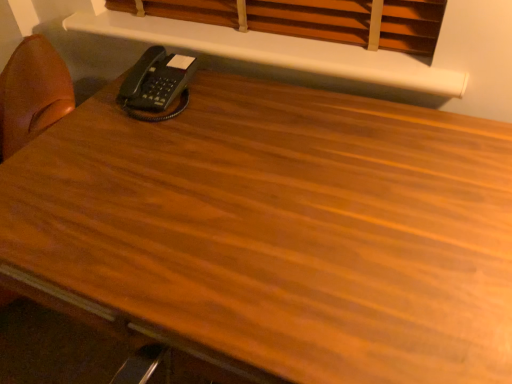
Question: Does wooden blinds at upper center have a greater height compared to black plastic phone at upper left?

Choices:
 (A) yes
 (B) no

Answer: (A)

Question: Is wooden blinds at upper center to the left of black plastic phone at upper left from the viewer's perspective?

Choices:
 (A) no
 (B) yes

Answer: (A)

Question: Are wooden blinds at upper center and black plastic phone at upper left far apart?

Choices:
 (A) no
 (B) yes

Answer: (A)

Question: Considering the relative sizes of wooden blinds at upper center and black plastic phone at upper left in the image provided, is wooden blinds at upper center wider than black plastic phone at upper left?

Choices:
 (A) no
 (B) yes

Answer: (A)

Question: Would you say wooden blinds at upper center contains black plastic phone at upper left?

Choices:
 (A) no
 (B) yes

Answer: (A)

Question: Could you tell me if wooden blinds at upper center is facing black plastic phone at upper left?

Choices:
 (A) no
 (B) yes

Answer: (A)

Question: Is black plastic phone at upper left at the left side of white matte shelf at upper center?

Choices:
 (A) yes
 (B) no

Answer: (A)

Question: Considering the relative sizes of black plastic phone at upper left and white matte shelf at upper center in the image provided, is black plastic phone at upper left taller than white matte shelf at upper center?

Choices:
 (A) yes
 (B) no

Answer: (A)

Question: From the image's perspective, is black plastic phone at upper left on top of white matte shelf at upper center?

Choices:
 (A) yes
 (B) no

Answer: (B)

Question: Is black plastic phone at upper left touching white matte shelf at upper center?

Choices:
 (A) no
 (B) yes

Answer: (A)

Question: Would you say black plastic phone at upper left contains white matte shelf at upper center?

Choices:
 (A) yes
 (B) no

Answer: (B)

Question: Are black plastic phone at upper left and white matte shelf at upper center far apart?

Choices:
 (A) no
 (B) yes

Answer: (A)

Question: From the image's perspective, does white matte shelf at upper center appear lower than black plastic phone at upper left?

Choices:
 (A) yes
 (B) no

Answer: (B)